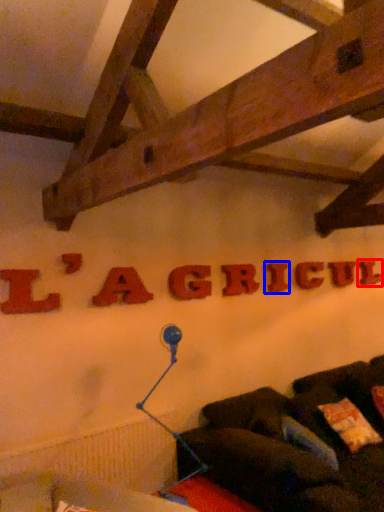
Question: Which object appears closest to the camera in this image, letter (highlighted by a red box) or letter (highlighted by a blue box)?

Choices:
 (A) letter
 (B) letter

Answer: (B)